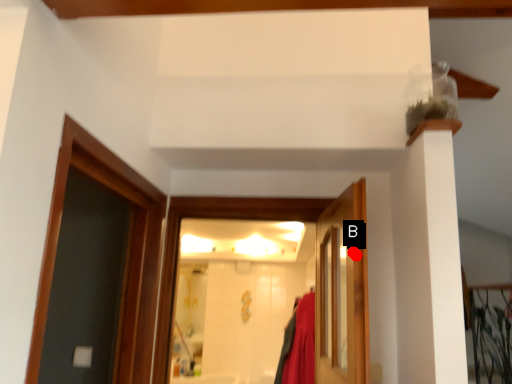
Question: Two points are circled on the image, labeled by A and B beside each circle. Which point appears farthest from the camera in this image?

Choices:
 (A) A is further
 (B) B is further

Answer: (B)